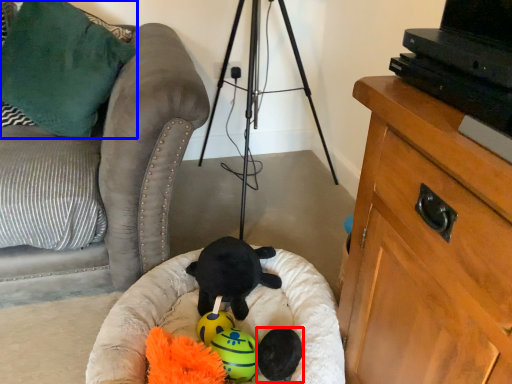
Question: Among these objects, which one is farthest to the camera, toy (highlighted by a red box) or pillow (highlighted by a blue box)?

Choices:
 (A) toy
 (B) pillow

Answer: (B)